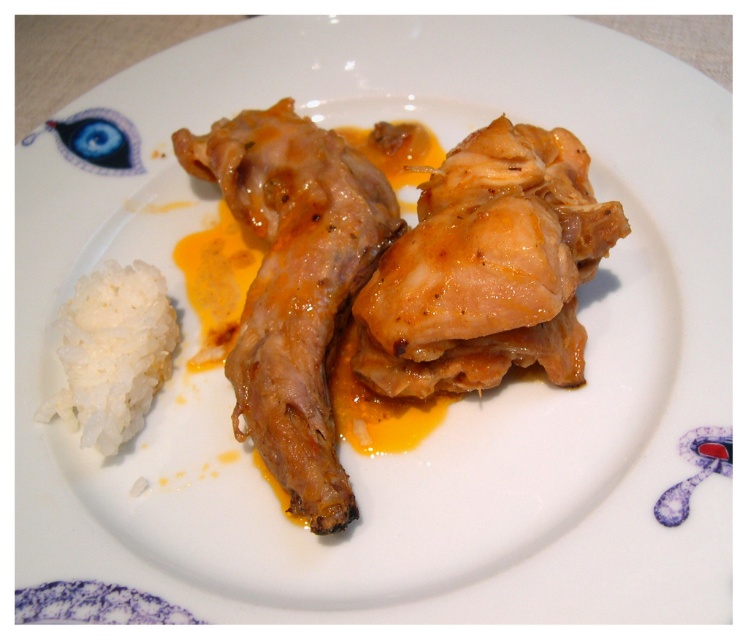
Does point (236, 118) come closer to viewer compared to point (94, 380)?

No, (236, 118) is further to viewer.

Between point (263, 134) and point (120, 337), which one is positioned in front?

Point (120, 337) is in front.

Where is `glossy brown chicken wing at center`? The image size is (748, 640). glossy brown chicken wing at center is located at coordinates (295, 285).